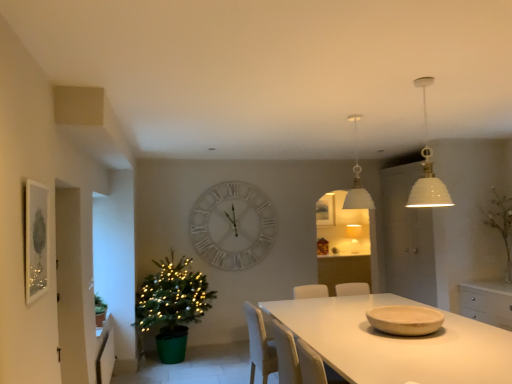
Locate an element on the screen. blank space above white matte clock at center (from a real-world perspective) is located at coordinates (236, 184).